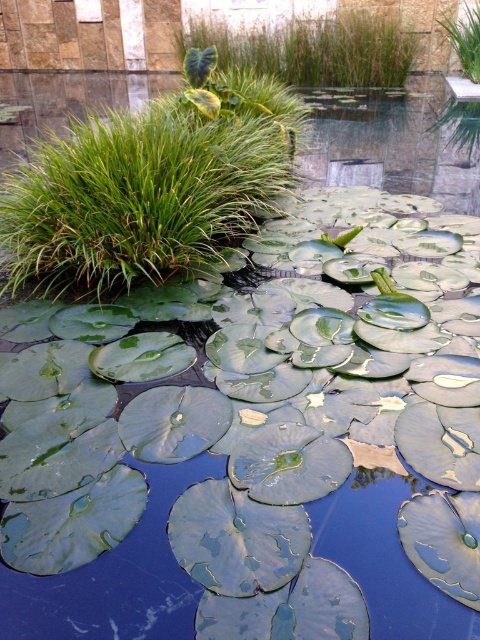
You are standing in the garden and want to place a small statue exactly at the point marked by the coordinates point (147, 188). Based on the scene description, where would this point be located relative to the green leafy grass at upper left?

The point (147, 188) corresponds to the location of the green leafy grass at upper left, so placing the statue there would position it directly at the green leafy grass at upper left.

You are a gardener trying to plant a new flower between the green leafy grass at upper center and the green glossy lily pad at upper center. Which object should you move to create more space?

The green leafy grass at upper center occupies less space than the green glossy lily pad at upper center, so you should move the green leafy grass at upper center to create more space.

You are a gardener planning to trim the green leafy grass at upper left and the green leafy grass at upper center. Which grass needs more trimming to match the other in thickness?

The green leafy grass at upper left is thinner than the green leafy grass at upper center, so you need to trim the green leafy grass at upper left more to increase its thickness to match the other.